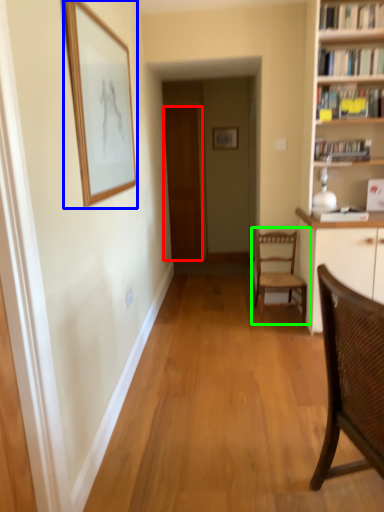
Question: Which object is the farthest from door (highlighted by a red box)? Choose among these: picture frame (highlighted by a blue box) or chair (highlighted by a green box).

Choices:
 (A) picture frame
 (B) chair

Answer: (A)